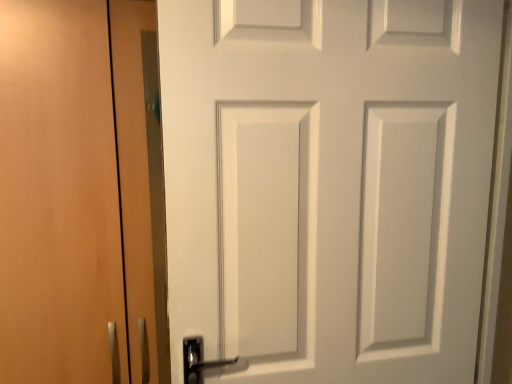
Question: From a real-world perspective, is matte wood cabinet at left physically located above or below white matte door at center?

Choices:
 (A) above
 (B) below

Answer: (B)

Question: Does point (60, 130) appear closer or farther from the camera than point (454, 87)?

Choices:
 (A) closer
 (B) farther

Answer: (A)

Question: In terms of height, does matte wood cabinet at left look taller or shorter compared to white matte door at center?

Choices:
 (A) tall
 (B) short

Answer: (A)

Question: Is white matte door at center in front of or behind matte wood cabinet at left in the image?

Choices:
 (A) behind
 (B) front

Answer: (B)

Question: Looking at their shapes, would you say white matte door at center is wider or thinner than matte wood cabinet at left?

Choices:
 (A) wide
 (B) thin

Answer: (B)

Question: Looking at the image, does white matte door at center seem bigger or smaller compared to matte wood cabinet at left?

Choices:
 (A) big
 (B) small

Answer: (B)

Question: In the image, is white matte door at center on the left side or the right side of matte wood cabinet at left?

Choices:
 (A) left
 (B) right

Answer: (B)